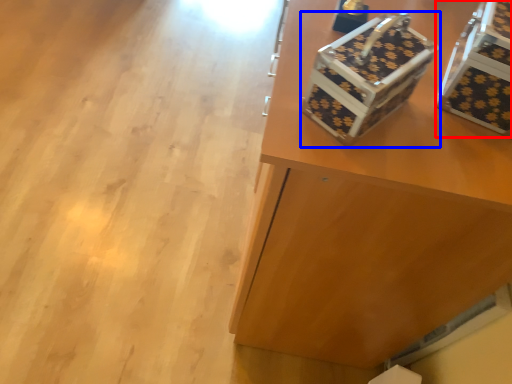
Question: Which object is closer to the camera taking this photo, storage box (highlighted by a red box) or shoe box (highlighted by a blue box)?

Choices:
 (A) storage box
 (B) shoe box

Answer: (B)